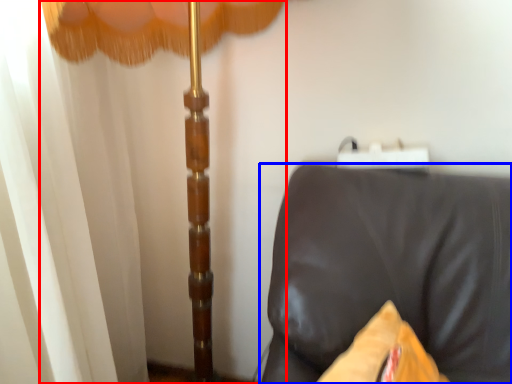
Question: Which object appears closest to the camera in this image, curtain (highlighted by a red box) or furniture (highlighted by a blue box)?

Choices:
 (A) curtain
 (B) furniture

Answer: (B)